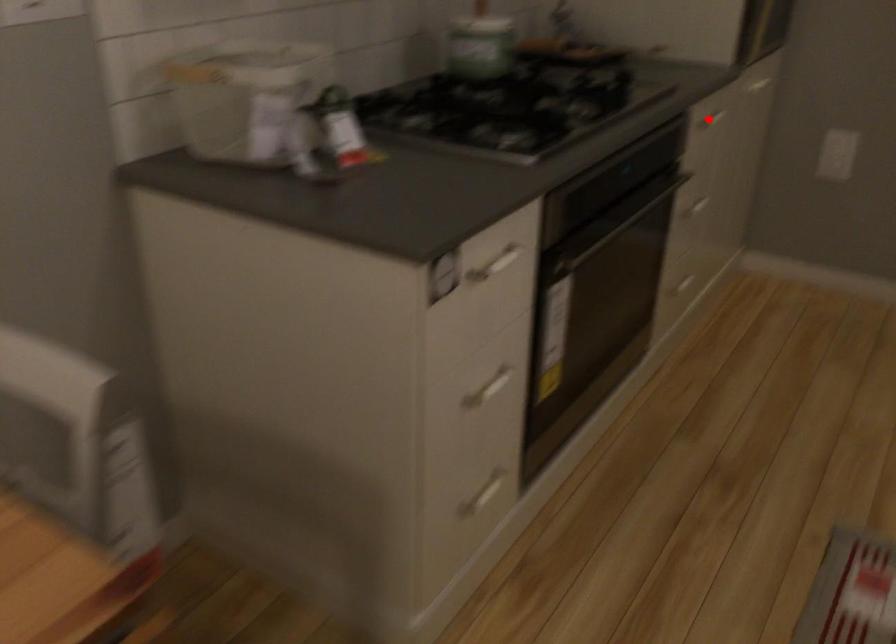
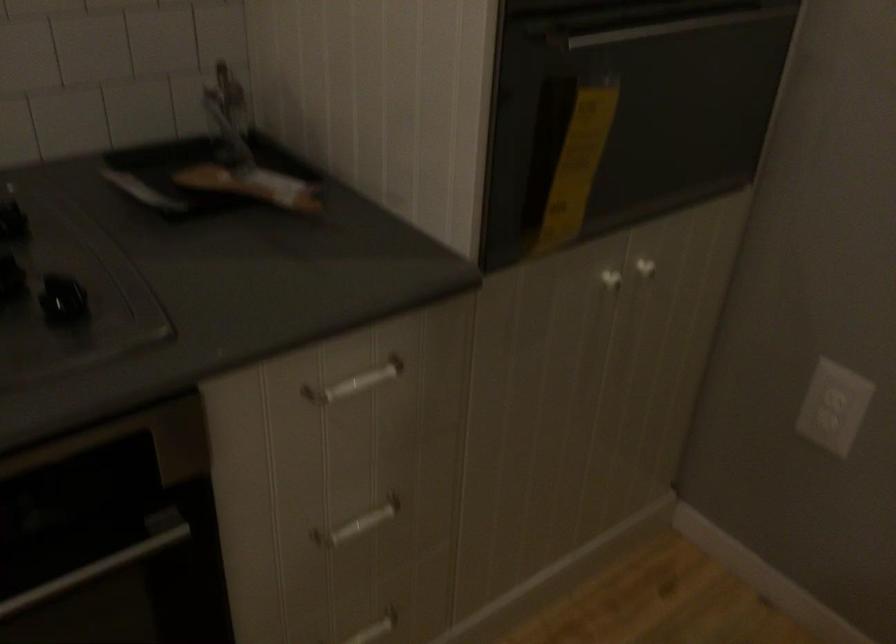
Question: I am providing you with two images of the same scene from different viewpoints. A red point is shown in image1. For the corresponding object point in image2, is it positioned nearer or farther from the camera?

Choices:
 (A) Nearer
 (B) Farther

Answer: (A)